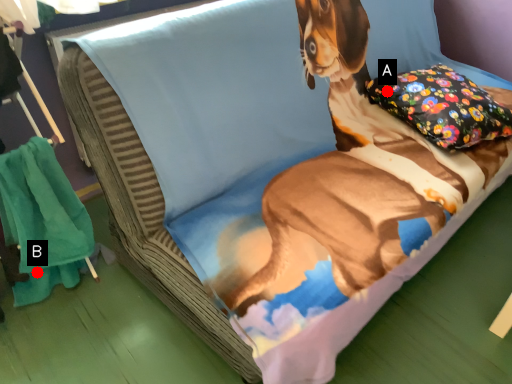
Question: Two points are circled on the image, labeled by A and B beside each circle. Which point appears closest to the camera in this image?

Choices:
 (A) A is closer
 (B) B is closer

Answer: (B)